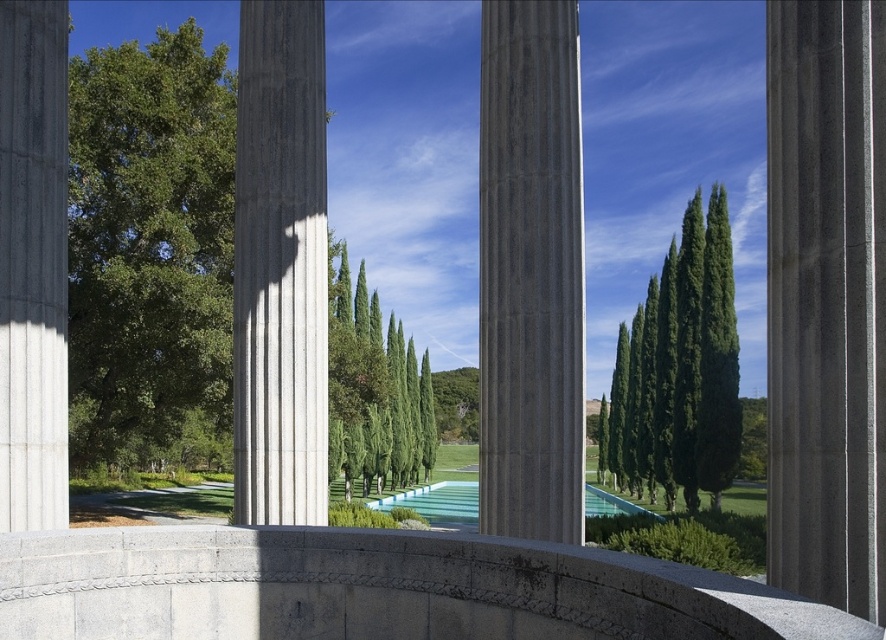
You are designing a garden layout and need to place both the smooth concrete column at center and the clear glass pool at center. Given their sizes, which object should you place closer to the entrance to ensure it doesn

The smooth concrete column at center occupies less space than the clear glass pool at center, so you should place the clear glass pool at center closer to the entrance to accommodate its larger size.

Looking at this image, you are standing in the middle of the columns and want to walk towards the point marked at coordinates (826, 300). Which direction should you face to reach the smooth concrete pillar at right?

You should face towards the right side to reach the smooth concrete pillar at right located at point (826, 300).